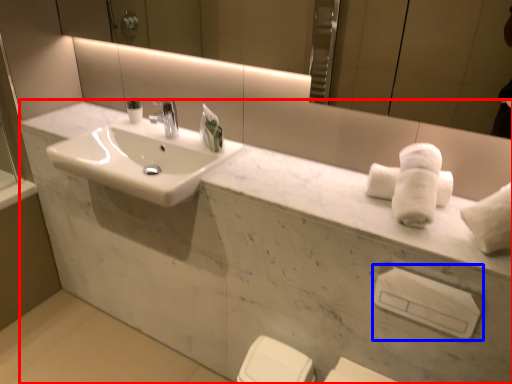
Question: Which object is further to the camera taking this photo, porcelain (highlighted by a red box) or towel bar (highlighted by a blue box)?

Choices:
 (A) porcelain
 (B) towel bar

Answer: (B)